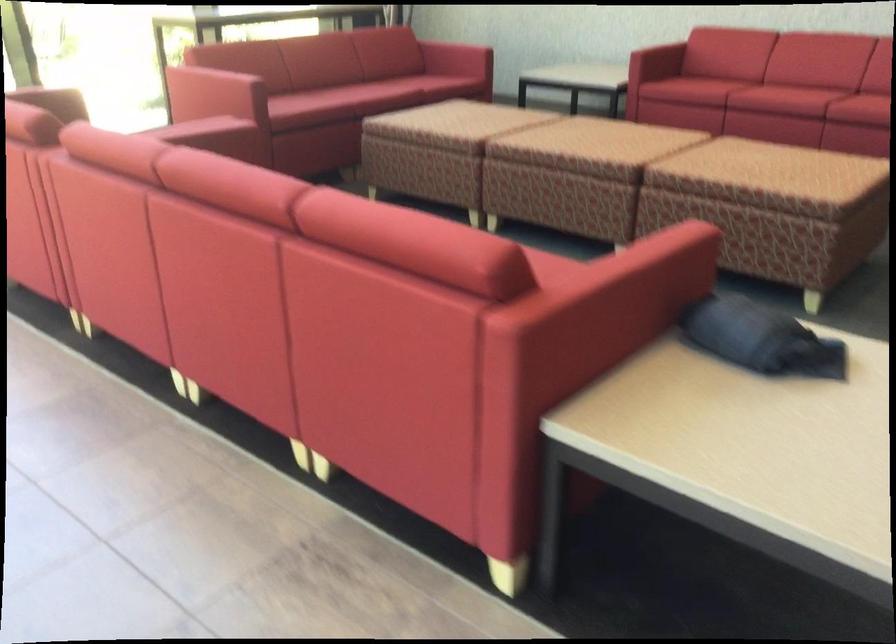
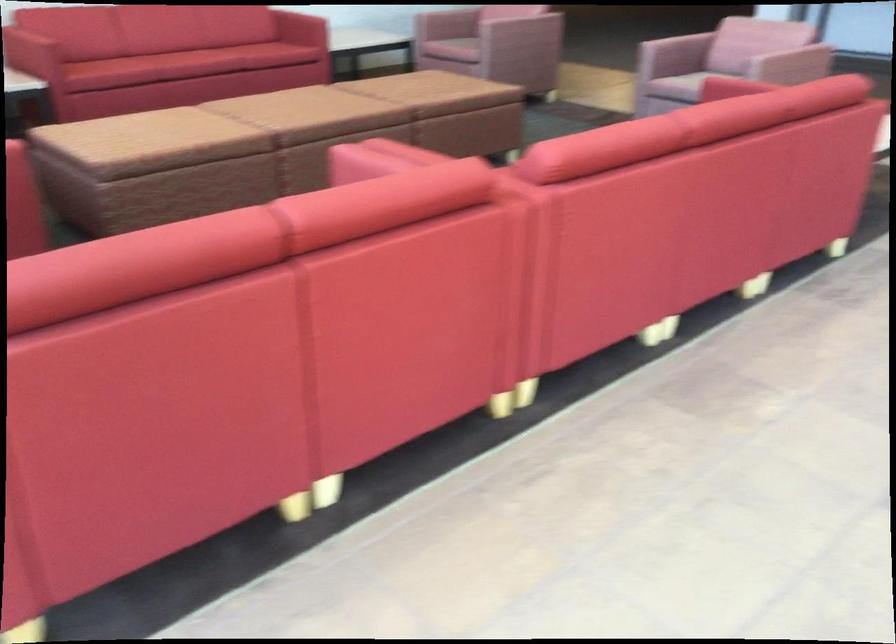
Based on the continuous images, in which direction is the camera rotating?

The camera's rotation is toward right-down.